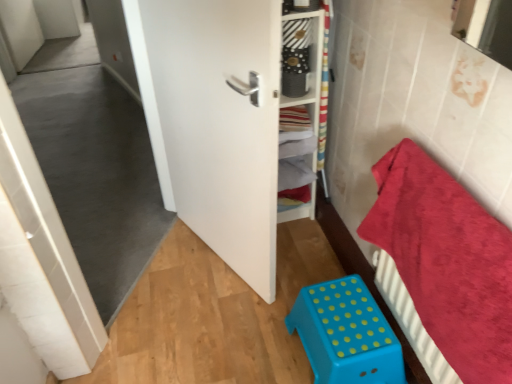
Question: Is white wooden shelf at center behind white matte door at center?

Choices:
 (A) no
 (B) yes

Answer: (B)

Question: Does white wooden shelf at center have a greater height compared to white matte door at center?

Choices:
 (A) yes
 (B) no

Answer: (B)

Question: Could you tell me if white wooden shelf at center is turned towards white matte door at center?

Choices:
 (A) yes
 (B) no

Answer: (B)

Question: Are white wooden shelf at center and white matte door at center making contact?

Choices:
 (A) no
 (B) yes

Answer: (A)

Question: Is white wooden shelf at center thinner than white matte door at center?

Choices:
 (A) no
 (B) yes

Answer: (A)

Question: From the image's perspective, is white wooden shelf at center above or below red plush towel at right?

Choices:
 (A) below
 (B) above

Answer: (B)

Question: Is white wooden shelf at center to the left or to the right of red plush towel at right in the image?

Choices:
 (A) right
 (B) left

Answer: (B)

Question: Does point (307, 157) appear closer or farther from the camera than point (408, 208)?

Choices:
 (A) farther
 (B) closer

Answer: (A)

Question: Is white wooden shelf at center bigger or smaller than red plush towel at right?

Choices:
 (A) big
 (B) small

Answer: (B)

Question: From the image's perspective, is blue plastic stool at lower center positioned above or below red plush towel at right?

Choices:
 (A) below
 (B) above

Answer: (A)

Question: Considering their positions, is blue plastic stool at lower center located in front of or behind red plush towel at right?

Choices:
 (A) behind
 (B) front

Answer: (A)

Question: From a real-world perspective, is blue plastic stool at lower center above or below red plush towel at right?

Choices:
 (A) below
 (B) above

Answer: (A)

Question: From their relative heights in the image, would you say blue plastic stool at lower center is taller or shorter than red plush towel at right?

Choices:
 (A) tall
 (B) short

Answer: (B)

Question: Is point (505, 299) positioned closer to the camera than point (273, 288)?

Choices:
 (A) farther
 (B) closer

Answer: (B)

Question: From the image's perspective, relative to white matte door at center, is red plush towel at right above or below?

Choices:
 (A) above
 (B) below

Answer: (B)